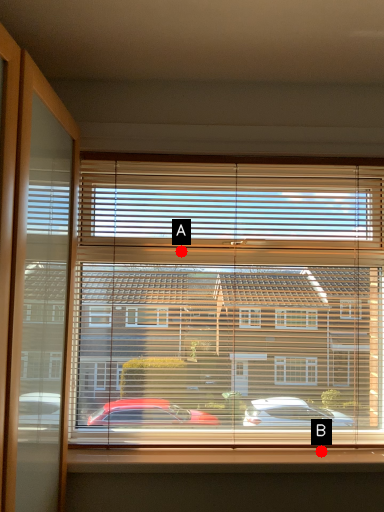
Question: Two points are circled on the image, labeled by A and B beside each circle. Which point appears farthest from the camera in this image?

Choices:
 (A) A is further
 (B) B is further

Answer: (A)